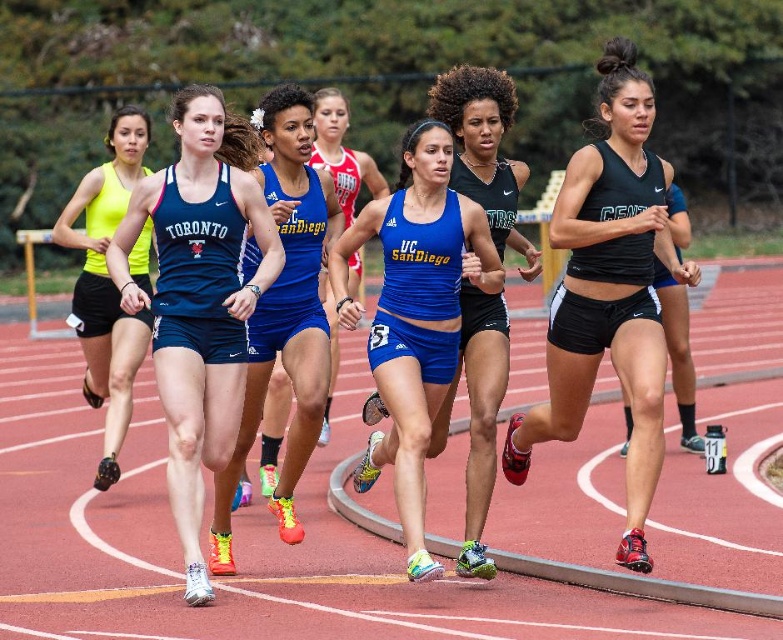
Can you confirm if black matte tank top at center is positioned to the right of blue fabric uniform at center?

Indeed, black matte tank top at center is positioned on the right side of blue fabric uniform at center.

Is point (668, 246) less distant than point (287, 108)?

Yes, it is in front of point (287, 108).

Where is `black matte tank top at center`? Image resolution: width=783 pixels, height=640 pixels. black matte tank top at center is located at coordinates (608, 291).

Measure the distance between point (96, 392) and camera.

The distance of point (96, 392) from camera is 33.70 feet.

Describe the element at coordinates (107, 284) in the screenshot. I see `neon yellow tank top at left` at that location.

Image resolution: width=783 pixels, height=640 pixels. In order to click on neon yellow tank top at left in this screenshot , I will do `click(107, 284)`.

Locate an element on the screen. neon yellow tank top at left is located at coordinates (107, 284).

Looking at this image, can you confirm if red rubber track at center is positioned to the right of matte blue tank top at center?

Correct, you'll find red rubber track at center to the right of matte blue tank top at center.

Is point (381, 605) closer to camera compared to point (172, 100)?

Yes, it is.

This screenshot has width=783, height=640. I want to click on red rubber track at center, so click(244, 541).